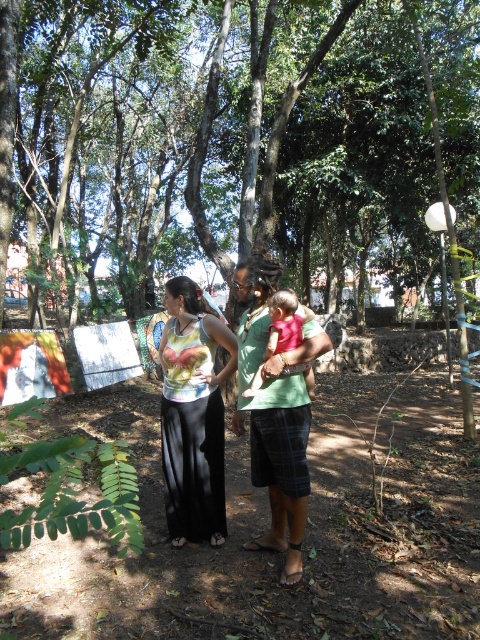
Between green plaid shorts at center and pink fabric baby at center, which one appears on the right side from the viewer's perspective?

pink fabric baby at center

Is green plaid shorts at center wider than pink fabric baby at center?

Indeed, green plaid shorts at center has a greater width compared to pink fabric baby at center.

Is point (252, 470) behind point (269, 304)?

Yes, point (252, 470) is farther from viewer.

Find the location of a particular element. The width and height of the screenshot is (480, 640). green plaid shorts at center is located at coordinates (275, 413).

Is printed fabric top at center smaller than pink fabric baby at center?

No.

Who is taller, printed fabric top at center or pink fabric baby at center?

printed fabric top at center

This screenshot has height=640, width=480. What are the coordinates of `printed fabric top at center` in the screenshot? It's located at (192, 416).

Can you confirm if green plaid shorts at center is positioned to the left of printed fabric top at center?

No, green plaid shorts at center is not to the left of printed fabric top at center.

Is green plaid shorts at center shorter than printed fabric top at center?

In fact, green plaid shorts at center may be taller than printed fabric top at center.

Between point (256, 464) and point (181, 378), which one is positioned behind?

The point (181, 378) is more distant.

Locate an element on the screen. green plaid shorts at center is located at coordinates (275, 413).